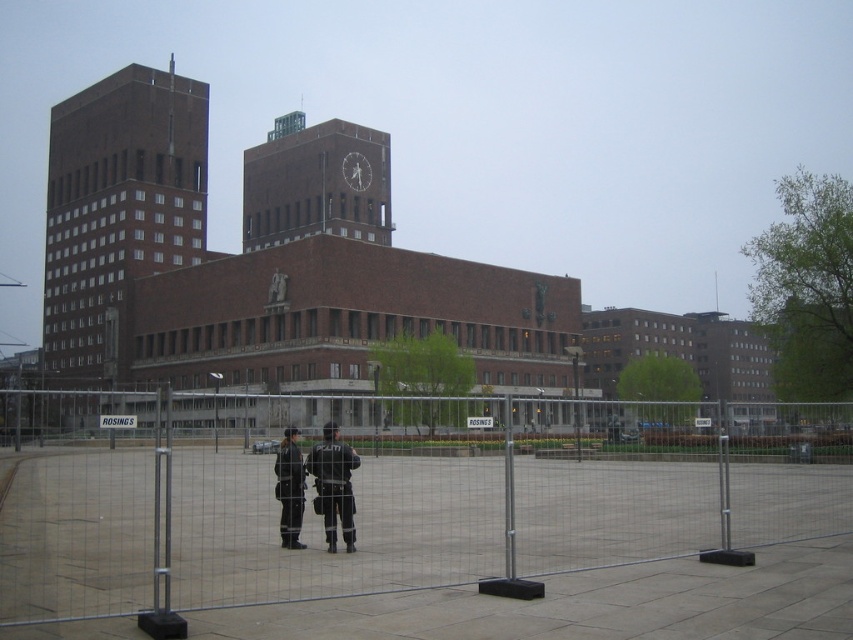
Question: Is brick clock tower at center positioned before reflective black uniforms at center?

Choices:
 (A) no
 (B) yes

Answer: (A)

Question: Which object appears farthest from the camera in this image?

Choices:
 (A) reflective black uniforms at center
 (B) brown brick tower at left

Answer: (B)

Question: Does brown brick tower at left have a lesser width compared to brick clock tower at center?

Choices:
 (A) no
 (B) yes

Answer: (A)

Question: Considering the real-world distances, which object is farthest from the brown brick tower at left?

Choices:
 (A) brick clock tower at center
 (B) black leather jacket at center

Answer: (B)

Question: Which of the following is the farthest from the observer?

Choices:
 (A) brick clock tower at center
 (B) black leather jacket at center
 (C) reflective black uniforms at center

Answer: (A)

Question: Does silver wire mesh fence at center appear over brick clock tower at center?

Choices:
 (A) no
 (B) yes

Answer: (A)